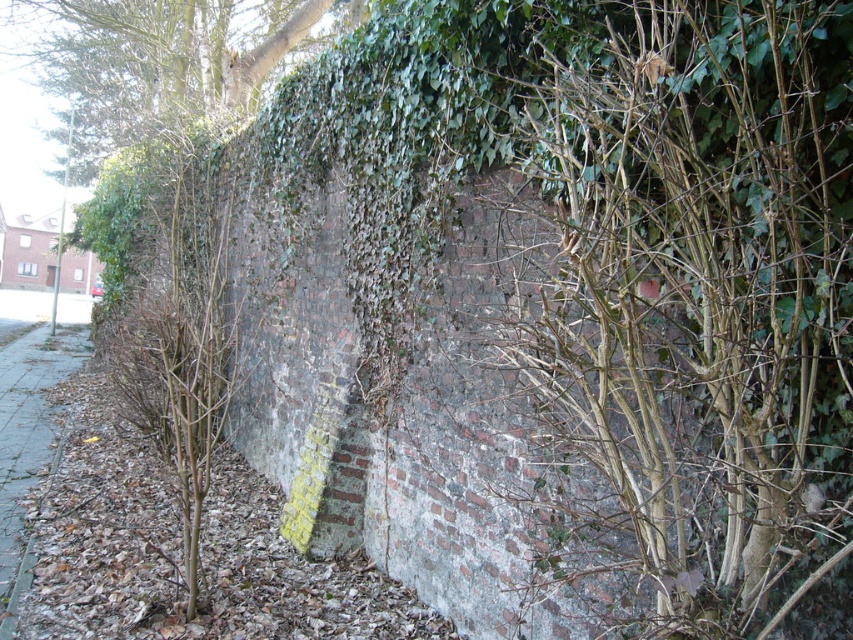
Question: Is bare branches at center bigger than gray concrete pavement at lower left?

Choices:
 (A) yes
 (B) no

Answer: (B)

Question: Which is farther from the green leafy tree at upper left?

Choices:
 (A) gray concrete pavement at lower left
 (B) bare branches at center

Answer: (B)

Question: Does bare branches at center have a smaller size compared to green leafy tree at upper left?

Choices:
 (A) yes
 (B) no

Answer: (A)

Question: Is bare branches at center to the right of gray concrete pavement at lower left from the viewer's perspective?

Choices:
 (A) yes
 (B) no

Answer: (A)

Question: Which point is farther to the camera?

Choices:
 (A) gray concrete pavement at lower left
 (B) bare branches at center
 (C) green leafy tree at upper left

Answer: (C)

Question: Estimate the real-world distances between objects in this image. Which object is farther from the bare branches at center?

Choices:
 (A) green leafy tree at upper left
 (B) gray concrete pavement at lower left

Answer: (A)